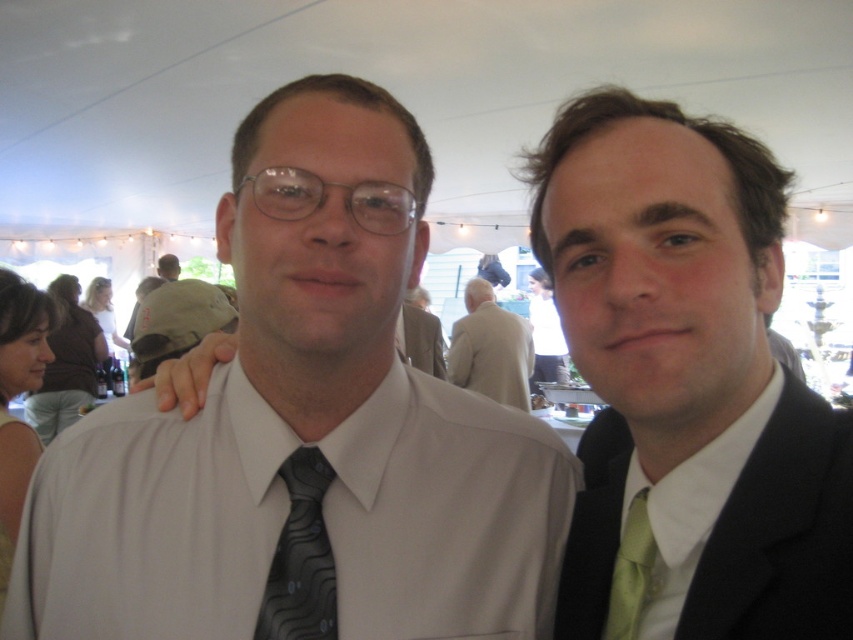
Question: Does light beige suit at center have a lesser width compared to white satin dress shirt at center?

Choices:
 (A) no
 (B) yes

Answer: (B)

Question: Which point is farther to the camera?

Choices:
 (A) green silk tie at center
 (B) black textured tie at center
 (C) matte khaki cap at left
 (D) black matte suit at right

Answer: (C)

Question: Does matte khaki cap at left appear on the left side of green silk tie at right?

Choices:
 (A) yes
 (B) no

Answer: (A)

Question: Where is black matte suit at right located in relation to green silk tie at right in the image?

Choices:
 (A) right
 (B) left

Answer: (A)

Question: Which point is closer to the camera?

Choices:
 (A) (480, 381)
 (B) (196, 289)

Answer: (B)

Question: Considering the real-world distances, which object is farthest from the green silk tie at right?

Choices:
 (A) light beige suit at center
 (B) black matte suit at right
 (C) matte khaki cap at left
 (D) black textured tie at center

Answer: (A)